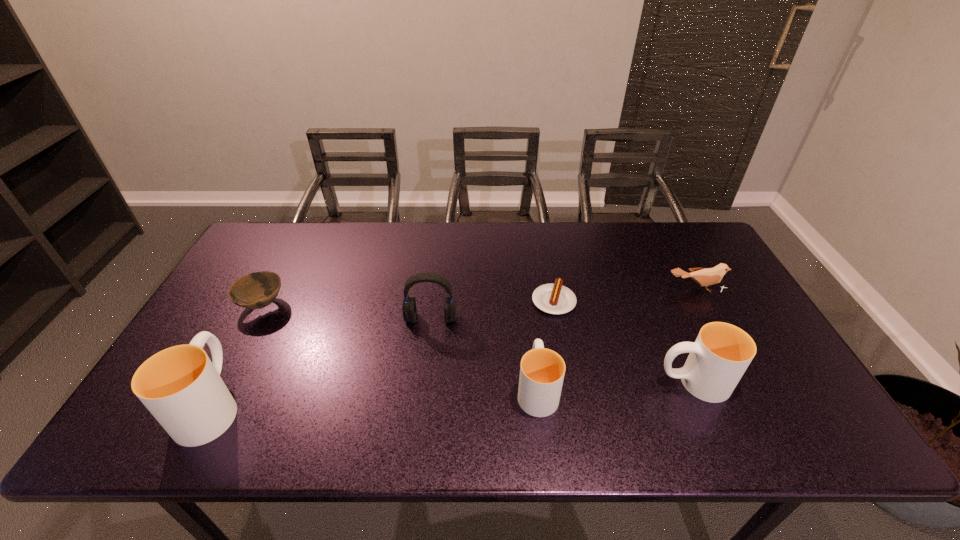
Please determine a free point for an extra cup to ensure balance. Please provide its 2D coordinates. Your answer should be formatted as a tuple, i.e. [(x, y)], where the tuple contains the x and y coordinates of a point satisfying the conditions above.

[(377, 396)]